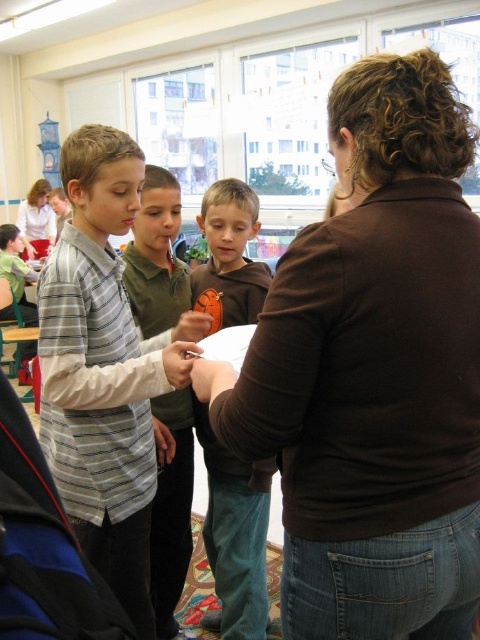
Question: Does brown matte shirt at center appear on the right side of matte white blouse at upper left?

Choices:
 (A) no
 (B) yes

Answer: (B)

Question: Does brown cotton shirt at center have a lesser width compared to matte plastic spoon at center?

Choices:
 (A) yes
 (B) no

Answer: (B)

Question: Among these points, which one is nearest to the camera?

Choices:
 (A) (166, 541)
 (B) (172, 333)
 (C) (183, 346)

Answer: (C)

Question: Estimate the real-world distances between objects in this image. Which object is farther from the brown cotton shirt at center?

Choices:
 (A) brown matte shirt at center
 (B) matte white blouse at upper left
 (C) green matte shirt at center

Answer: (B)

Question: Can you confirm if brown matte shirt at center is smaller than matte plastic spoon at center?

Choices:
 (A) yes
 (B) no

Answer: (B)

Question: Which of the following is the closest to the observer?

Choices:
 (A) matte white blouse at upper left
 (B) matte skin hand at center
 (C) green matte shirt at center
 (D) matte plastic spoon at center

Answer: (B)